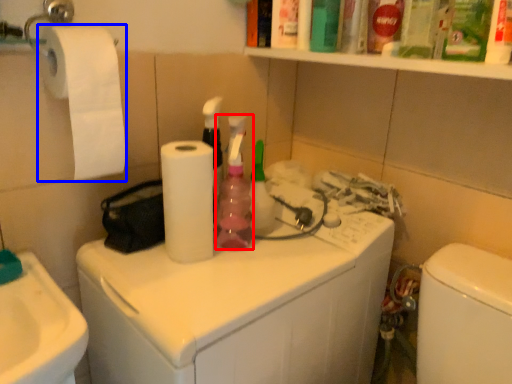
Question: Which point is closer to the camera, cleaning product (highlighted by a red box) or toilet paper (highlighted by a blue box)?

Choices:
 (A) cleaning product
 (B) toilet paper

Answer: (B)